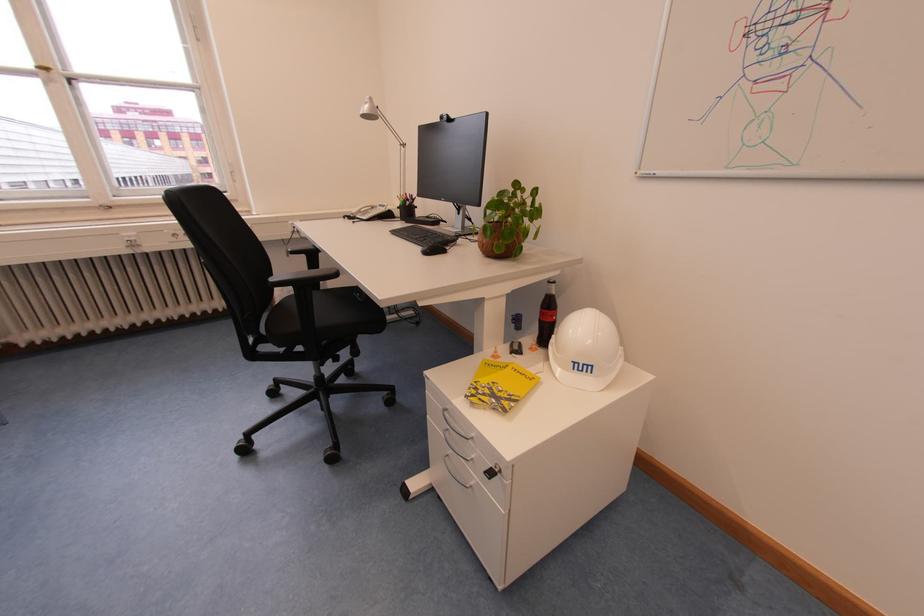
At what (x,y) coordinates should I click in order to perform the action: click on desk lamp head. Please return your answer as a coordinate pair (x, y). Looking at the image, I should click on [369, 110].